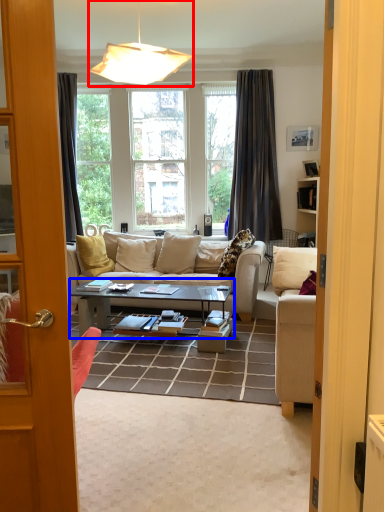
Question: Among these objects, which one is farthest to the camera, lamp (highlighted by a red box) or coffee table (highlighted by a blue box)?

Choices:
 (A) lamp
 (B) coffee table

Answer: (B)